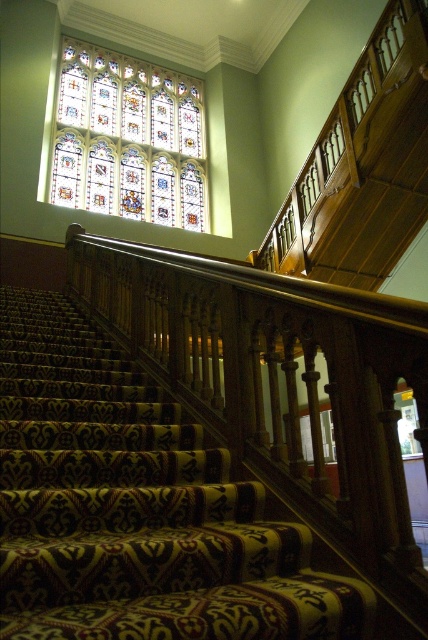
Question: Which object appears farthest from the camera in this image?

Choices:
 (A) patterned carpet stairs at center
 (B) stained glass at upper left

Answer: (B)

Question: Is patterned carpet stairs at center to the left of stained glass at upper left from the viewer's perspective?

Choices:
 (A) yes
 (B) no

Answer: (B)

Question: Which point is farther to the camera?

Choices:
 (A) (151, 118)
 (B) (18, 307)

Answer: (A)

Question: Which of the following is the farthest from the observer?

Choices:
 (A) stained glass at upper left
 (B) patterned carpet stairs at center

Answer: (A)

Question: Does patterned carpet stairs at center lie in front of stained glass at upper left?

Choices:
 (A) yes
 (B) no

Answer: (A)

Question: Considering the relative positions of patterned carpet stairs at center and stained glass at upper left in the image provided, where is patterned carpet stairs at center located with respect to stained glass at upper left?

Choices:
 (A) left
 (B) right

Answer: (B)